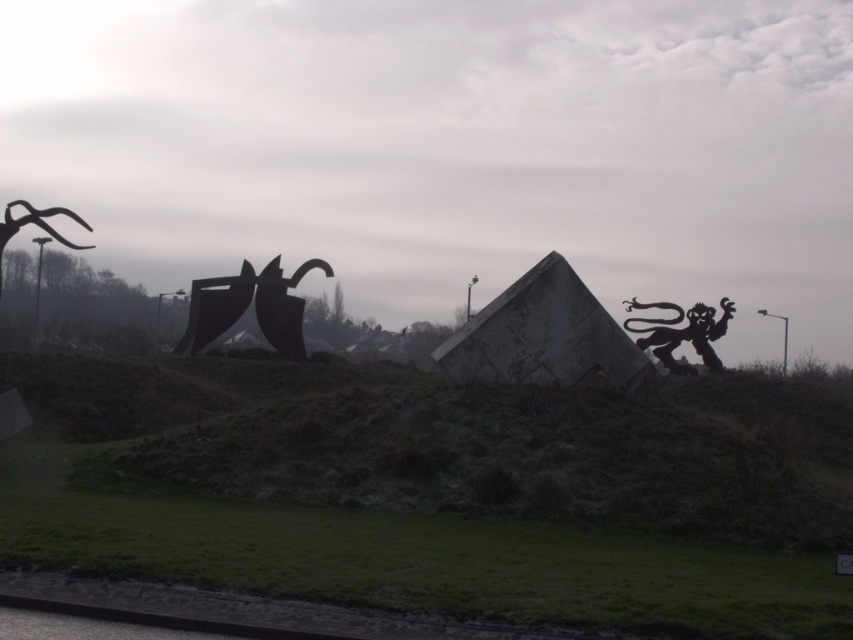
You are an art curator planning to install a new sculpture in this outdoor space. The new sculpture will be placed between the black matte sculpture at center and the dark matte lion at upper right. If the new sculpture must be shorter than both existing sculptures, which one should you use as a reference for the maximum height?

The black matte sculpture at center is taller than the dark matte lion at upper right. Therefore, you should use the dark matte lion at upper right as the reference for the maximum height since it is shorter, ensuring the new sculpture is shorter than both.